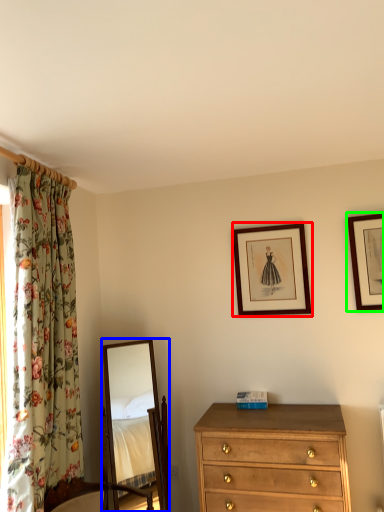
Question: Which is nearer to the picture frame (highlighted by a red box)? mirror (highlighted by a blue box) or picture frame (highlighted by a green box).

Choices:
 (A) mirror
 (B) picture frame

Answer: (B)